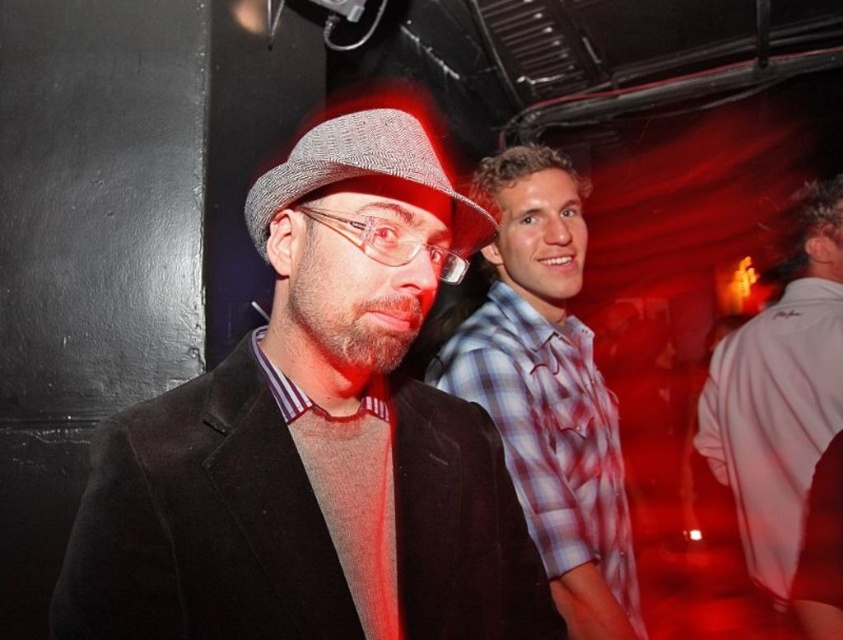
Question: Which point is closer to the camera?

Choices:
 (A) (793, 561)
 (B) (423, 273)

Answer: (B)

Question: Which of the following is the closest to the observer?

Choices:
 (A) (267, 572)
 (B) (475, 204)
 (C) (823, 404)

Answer: (A)

Question: From the image, what is the correct spatial relationship of white cotton shirt at right in relation to herringbone fabric fedora at center?

Choices:
 (A) right
 (B) left

Answer: (A)

Question: Can you confirm if matte black suit at center is bigger than herringbone fabric fedora at center?

Choices:
 (A) no
 (B) yes

Answer: (B)

Question: Which object is positioned farthest from the herringbone fabric fedora at center?

Choices:
 (A) white cotton shirt at right
 (B) plaid cotton shirt at center

Answer: (A)

Question: Where is plaid cotton shirt at center located in relation to herringbone fabric fedora at center in the image?

Choices:
 (A) left
 (B) right

Answer: (B)